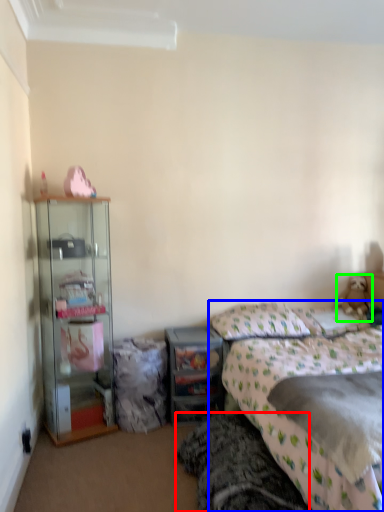
Question: Which is farther away from bed frame (highlighted by a red box)? bed (highlighted by a blue box) or teddy bear (highlighted by a green box)?

Choices:
 (A) bed
 (B) teddy bear

Answer: (B)